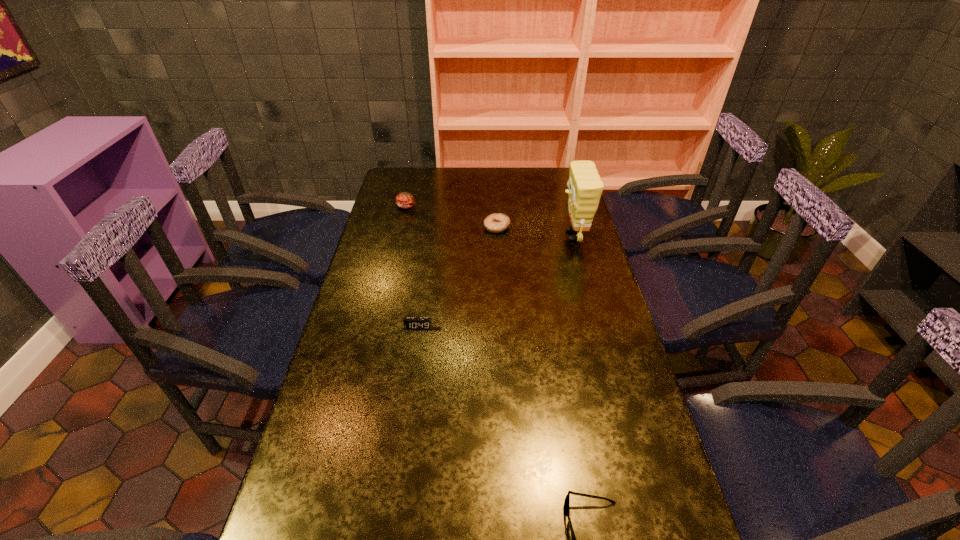
I want to click on free space that is in between the tomato and the second object from left to right, so click(x=413, y=267).

This screenshot has height=540, width=960. Find the location of `free space between the second object from left to right and the leftmost object`. free space between the second object from left to right and the leftmost object is located at coordinates (413, 267).

Locate an element on the screen. The width and height of the screenshot is (960, 540). blank region between the second nearest object and the third object from left to right is located at coordinates (458, 278).

Identify the location of object that is the third closest to the sunglasses. Image resolution: width=960 pixels, height=540 pixels. (497, 222).

Where is `object that is the fourth closest one to the second nearest object`? This screenshot has width=960, height=540. object that is the fourth closest one to the second nearest object is located at coordinates (405, 200).